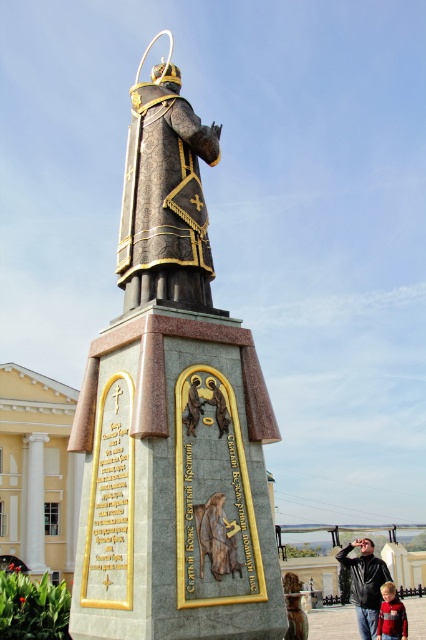
You are a tour guide leading a group of visitors to the polished bronze statue at center and the gold textured statue at center. The group wants to know if they can comfortably walk between the two statues without feeling cramped. The average width of a person is 0.5 meters. Can they walk between the two statues comfortably?

The distance between the polished bronze statue at center and the gold textured statue at center is 26.73 meters. Since the average width of a person is only 0.5 meters, there is ample space for visitors to comfortably walk between the two statues without feeling cramped.